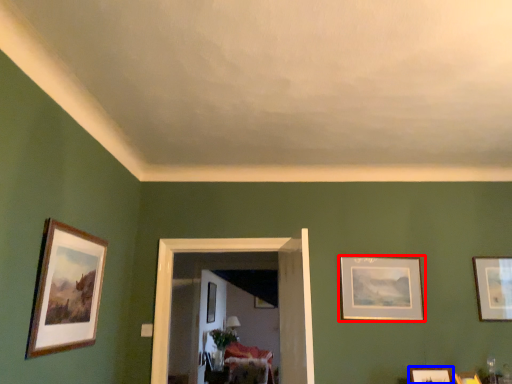
Question: Which object appears farthest to the camera in this image, picture frame (highlighted by a red box) or picture frame (highlighted by a blue box)?

Choices:
 (A) picture frame
 (B) picture frame

Answer: (A)